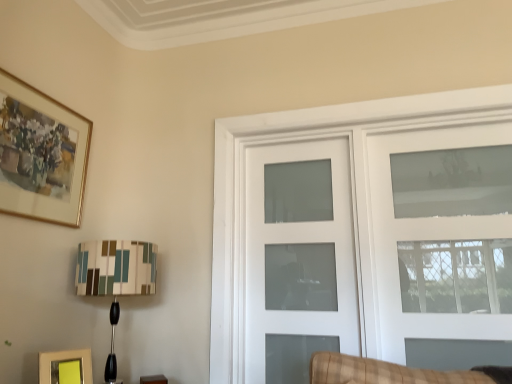
Question: Which direction should I rotate to face white frosted glass door at center, the second door in the right-to-left sequence, — up or down?

Choices:
 (A) down
 (B) up

Answer: (A)

Question: From the image's perspective, is white frosted glass door at center, which is the first door from left to right, located beneath matte yellow picture frame at lower left, acting as the first picture frame starting from the right?

Choices:
 (A) yes
 (B) no

Answer: (B)

Question: Is white frosted glass door at center, which is the first door from left to right, at the right side of matte yellow picture frame at lower left, the second picture frame from the left?

Choices:
 (A) yes
 (B) no

Answer: (A)

Question: Would you consider white frosted glass door at center, which is the first door from left to right, to be distant from matte yellow picture frame at lower left, acting as the first picture frame starting from the right?

Choices:
 (A) no
 (B) yes

Answer: (B)

Question: From the image's perspective, is white frosted glass door at center, which is the first door from left to right, on matte yellow picture frame at lower left, acting as the first picture frame starting from the right?

Choices:
 (A) no
 (B) yes

Answer: (B)

Question: Is white frosted glass door at center, the second door in the right-to-left sequence, located outside matte yellow picture frame at lower left, acting as the 2th picture frame starting from the top?

Choices:
 (A) no
 (B) yes

Answer: (B)

Question: Does white frosted glass door at center, which is the first door from left to right, have a larger size compared to matte yellow picture frame at lower left, the second picture frame from the left?

Choices:
 (A) yes
 (B) no

Answer: (A)

Question: From the image's perspective, is gold-framed painting at upper left, arranged as the 2th picture frame when viewed from the right, on top of white frosted glass door at center, the second door in the right-to-left sequence?

Choices:
 (A) yes
 (B) no

Answer: (A)

Question: Is the depth of gold-framed painting at upper left, arranged as the first picture frame when viewed from the left, less than that of white frosted glass door at center, the second door in the right-to-left sequence?

Choices:
 (A) no
 (B) yes

Answer: (B)

Question: Would you consider gold-framed painting at upper left, arranged as the 2th picture frame when viewed from the right, to be distant from white frosted glass door at center, the second door in the right-to-left sequence?

Choices:
 (A) yes
 (B) no

Answer: (A)

Question: Considering the relative positions of gold-framed painting at upper left, arranged as the 2th picture frame when viewed from the right, and white frosted glass door at center, the second door in the right-to-left sequence, in the image provided, is gold-framed painting at upper left, arranged as the 2th picture frame when viewed from the right, behind white frosted glass door at center, the second door in the right-to-left sequence,?

Choices:
 (A) yes
 (B) no

Answer: (B)

Question: Could white frosted glass door at center, which is the first door from left to right, be considered to be inside gold-framed painting at upper left, arranged as the 2th picture frame when viewed from the right?

Choices:
 (A) no
 (B) yes

Answer: (A)

Question: Does gold-framed painting at upper left, the second picture frame from the bottom, have a greater height compared to white frosted glass door at center, which is the first door from left to right?

Choices:
 (A) no
 (B) yes

Answer: (A)

Question: Is gold-framed painting at upper left, arranged as the first picture frame when viewed from the left, positioned before matte yellow picture frame at lower left, the second picture frame from the left?

Choices:
 (A) no
 (B) yes

Answer: (B)